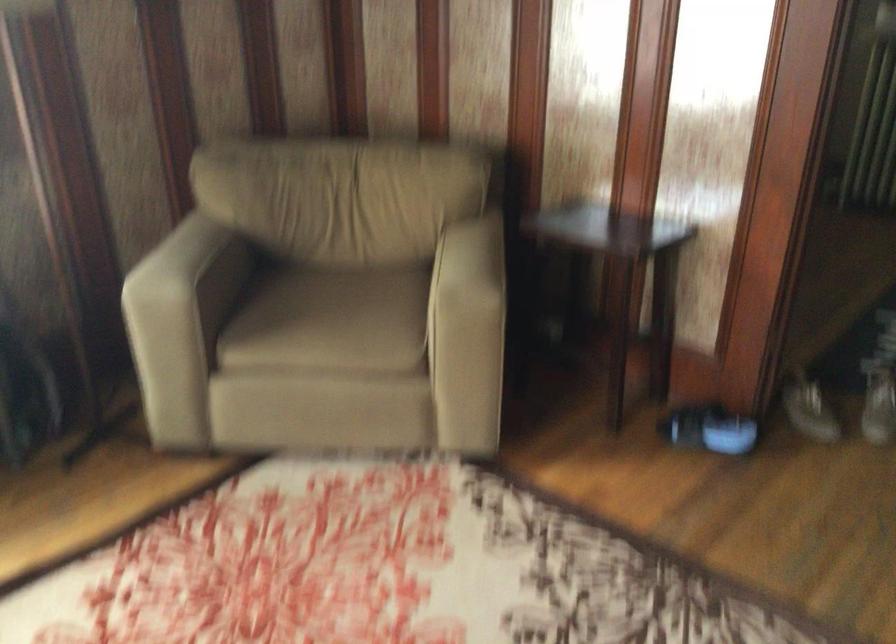
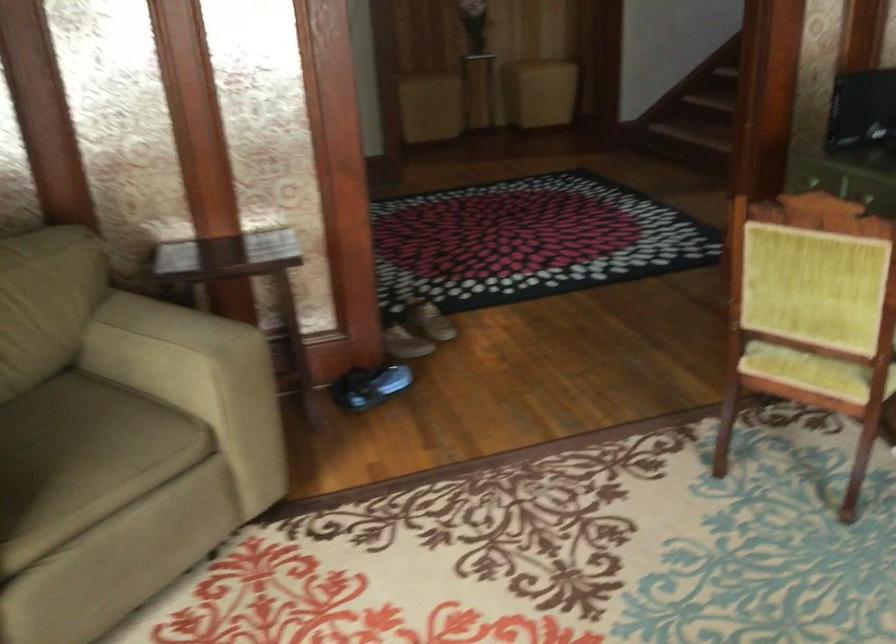
Where in the second image is the point corresponding to pixel 703 427 from the first image?

(369, 386)